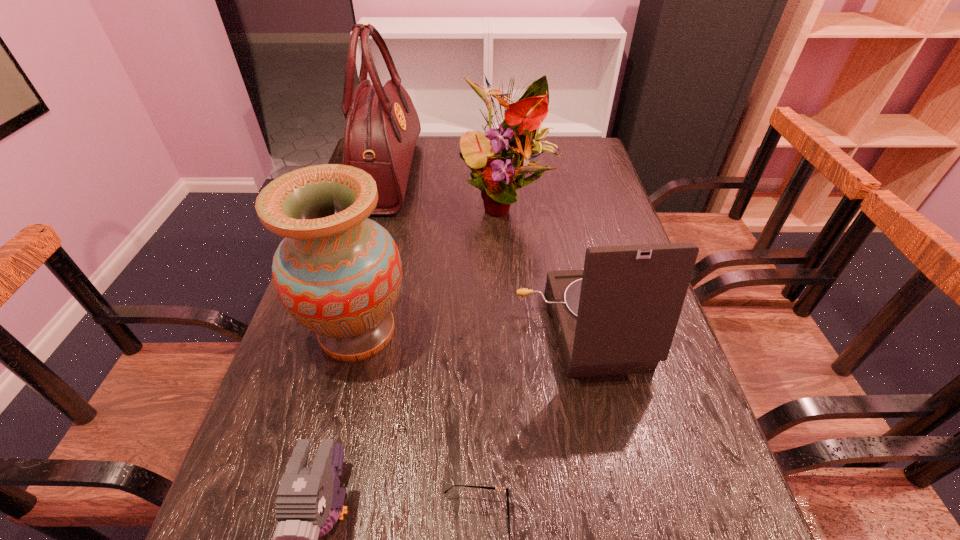
I want to click on handbag, so click(x=382, y=126).

Where is `vase`? The width and height of the screenshot is (960, 540). vase is located at coordinates click(x=337, y=273).

Locate an element on the screen. This screenshot has width=960, height=540. bouquet is located at coordinates (512, 146).

Locate an element on the screen. phonograph record is located at coordinates (618, 315).

Locate an element on the screen. Image resolution: width=960 pixels, height=540 pixels. free location located 0.070m on the front-facing side of the tallest object is located at coordinates (437, 174).

Identify the location of vacant region located on the front of the vase. The image size is (960, 540). (328, 445).

Find the location of a particular element. This screenshot has width=960, height=540. vacant space located 0.100m on the front-facing side of the bouquet is located at coordinates (510, 257).

The image size is (960, 540). Find the location of `vacant space positioned on the left of the phonograph record`. vacant space positioned on the left of the phonograph record is located at coordinates (353, 330).

Locate an element on the screen. The height and width of the screenshot is (540, 960). object at the far edge is located at coordinates (382, 126).

Where is `handbag present at the left edge`? handbag present at the left edge is located at coordinates (382, 126).